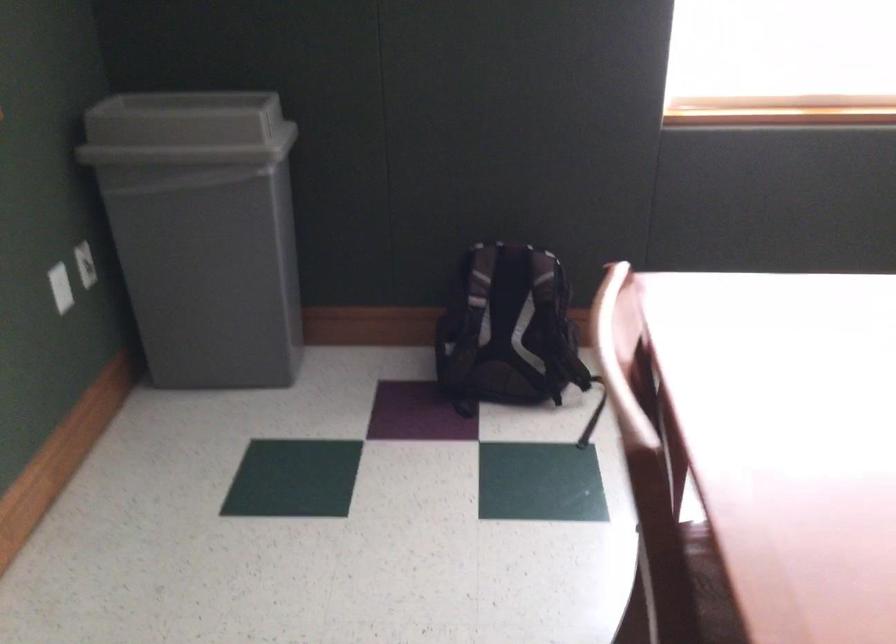
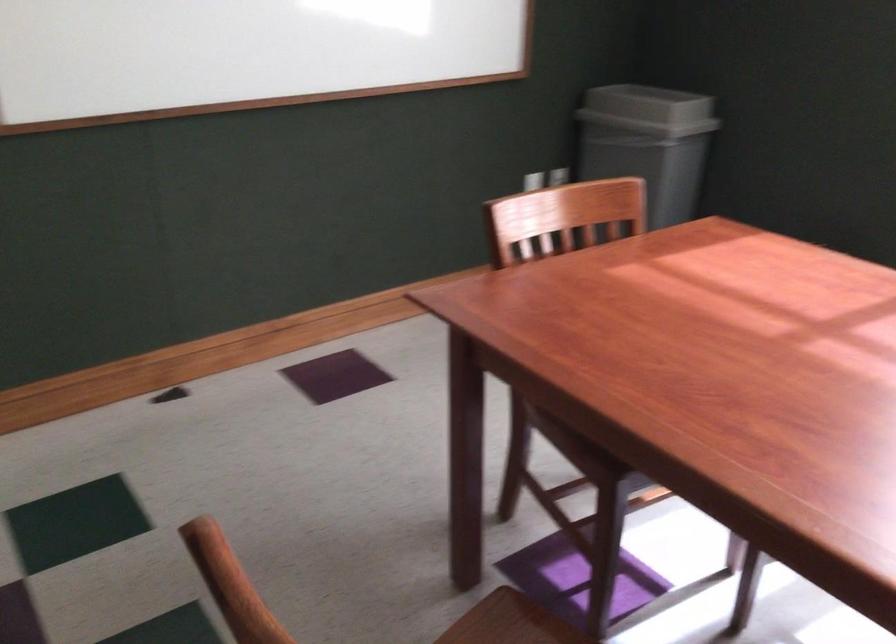
In the second image, find the point that corresponds to (x=230, y=129) in the first image.

(648, 109)